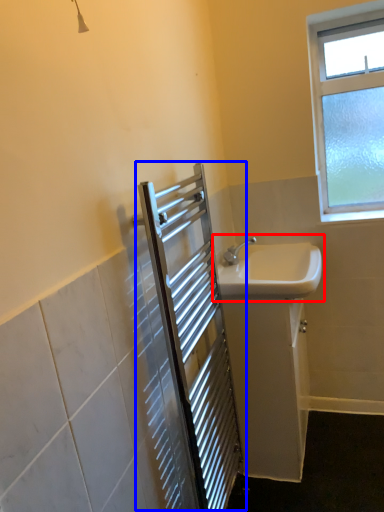
Question: Which object appears farthest to the camera in this image, sink (highlighted by a red box) or screen door (highlighted by a blue box)?

Choices:
 (A) sink
 (B) screen door

Answer: (A)